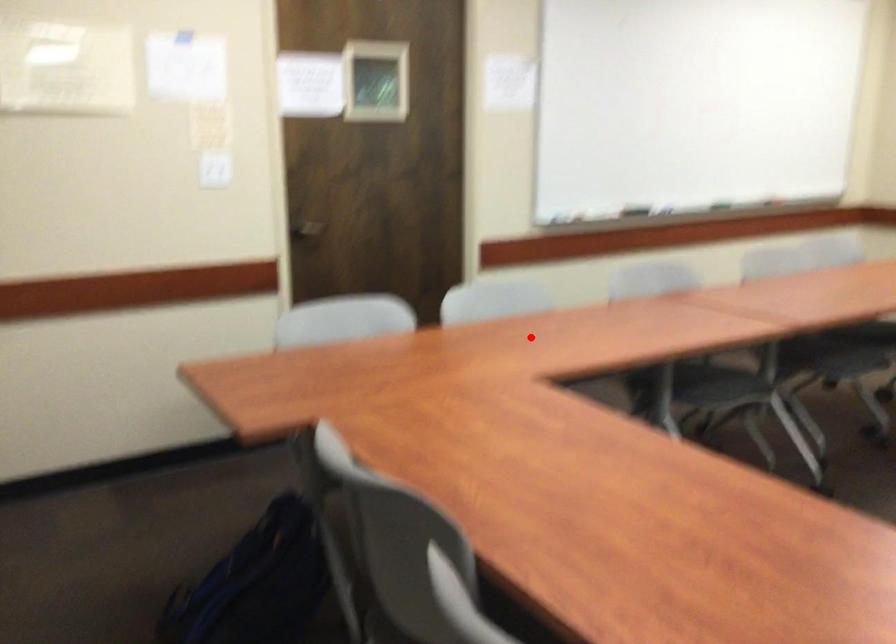
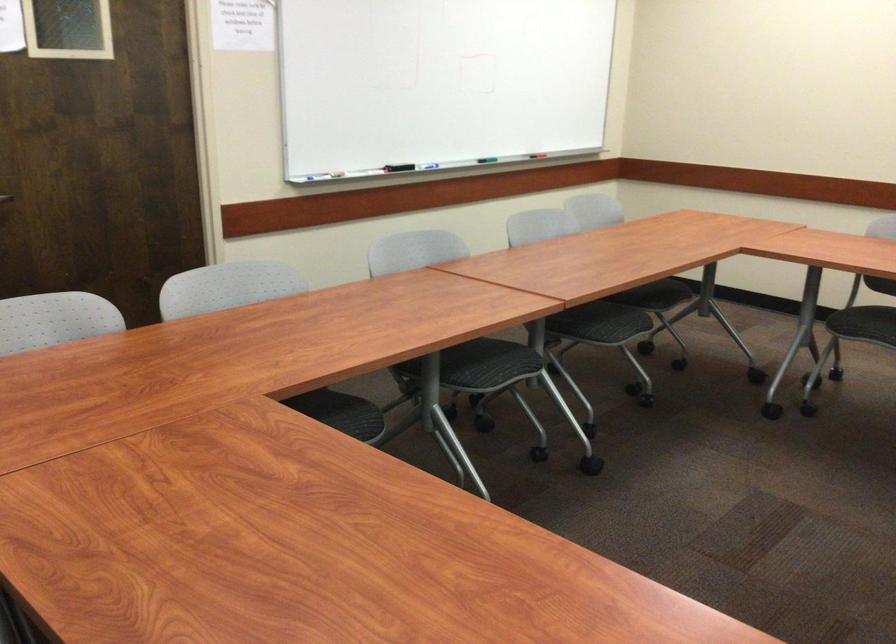
Question: I am providing you with two images of the same scene from different viewpoints. In image1, a red point is highlighted. Considering the same 3D point in image2, which of the following is correct?

Choices:
 (A) It is closer
 (B) It is farther

Answer: (A)